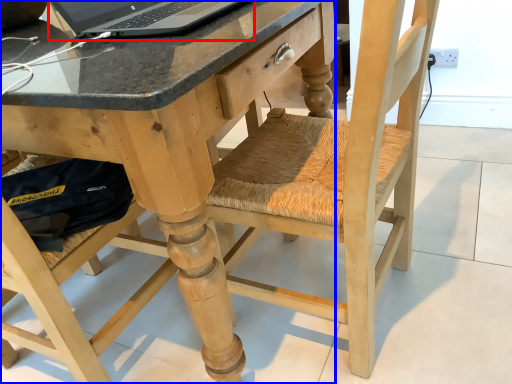
Question: Which object appears closest to the camera in this image, laptop (highlighted by a red box) or desk (highlighted by a blue box)?

Choices:
 (A) laptop
 (B) desk

Answer: (B)